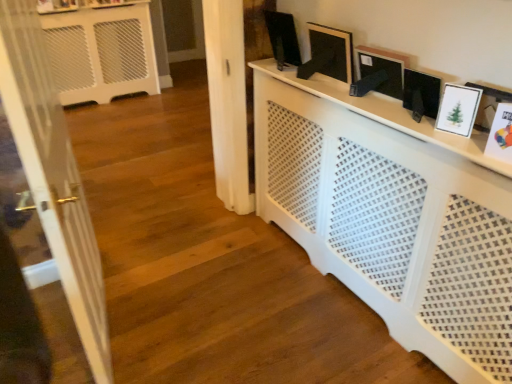
Where is `vacant area situated to the left side of black matte picture frame at upper center, which is the second picture frame from left to right`? Image resolution: width=512 pixels, height=384 pixels. vacant area situated to the left side of black matte picture frame at upper center, which is the second picture frame from left to right is located at coordinates (310, 77).